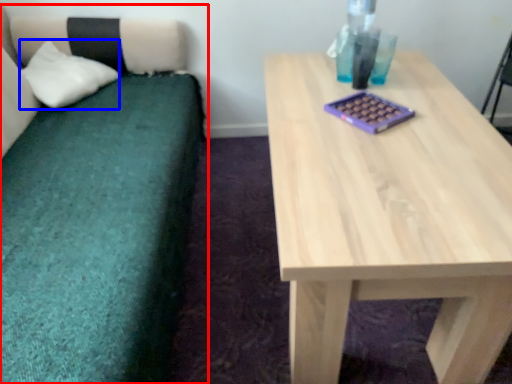
Question: Which object is further to the camera taking this photo, studio couch (highlighted by a red box) or pillow (highlighted by a blue box)?

Choices:
 (A) studio couch
 (B) pillow

Answer: (B)